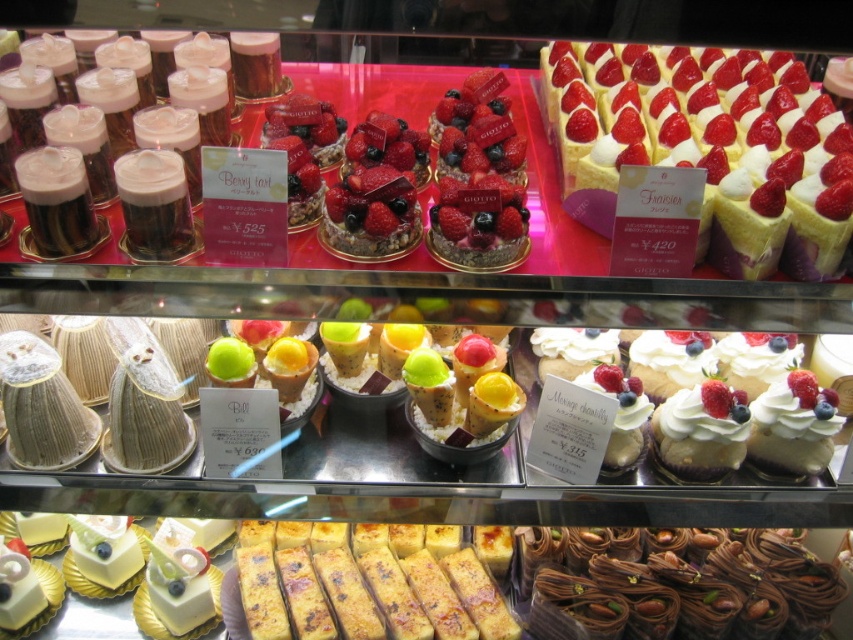
Can you confirm if white cream mousse at center is positioned below white glossy cake at center?

Actually, white cream mousse at center is above white glossy cake at center.

Can you confirm if white cream mousse at center is shorter than white glossy cake at center?

No.

Locate an element on the screen. white cream mousse at center is located at coordinates coord(793,426).

The height and width of the screenshot is (640, 853). Find the location of `white cream mousse at center`. white cream mousse at center is located at coordinates (793, 426).

Is smooth white cream tart at upper right thinner than white cream mousse at center?

No.

Is point (718, 99) more distant than point (815, 397)?

Yes, it is.

At what (x,y) coordinates should I click in order to perform the action: click on smooth white cream tart at upper right. Please return your answer as a coordinate pair (x, y). The width and height of the screenshot is (853, 640). Looking at the image, I should click on (709, 147).

Is point (718, 616) less distant than point (96, 541)?

That is True.

Between chocolate-coated pastry at lower right and white glossy cake at center, which one appears on the left side from the viewer's perspective?

Positioned to the left is white glossy cake at center.

Does point (537, 637) come closer to viewer compared to point (68, 580)?

That is True.

Where is `chocolate-coated pastry at lower right`? chocolate-coated pastry at lower right is located at coordinates (677, 582).